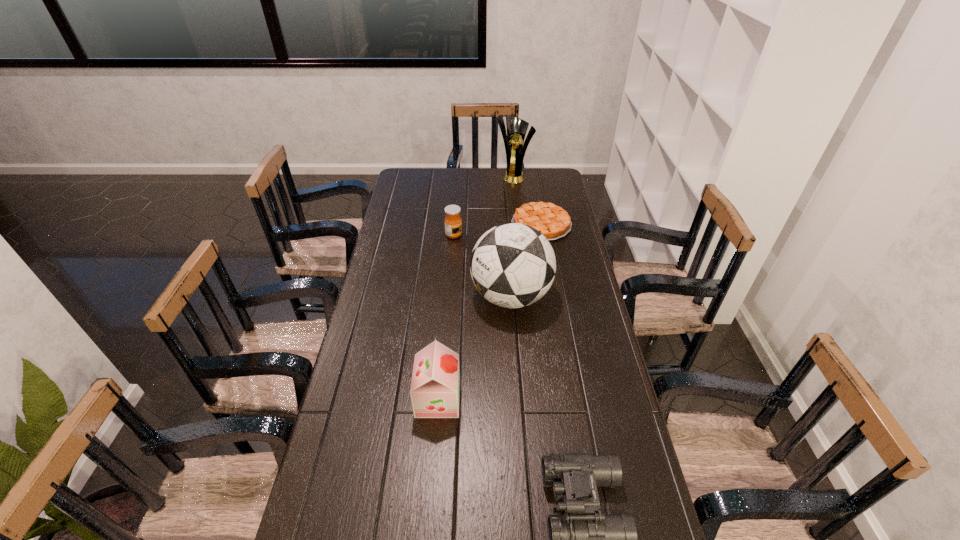
Find the location of a particular element. This screenshot has width=960, height=540. free location located 0.130m with the cap open on the fifth farthest object is located at coordinates (504, 399).

Where is `vacant space situated 0.180m on the front-facing side of the honey`? The image size is (960, 540). vacant space situated 0.180m on the front-facing side of the honey is located at coordinates (504, 235).

Where is `vacant space located on the back of the shortest object`? This screenshot has height=540, width=960. vacant space located on the back of the shortest object is located at coordinates (532, 171).

You are a GUI agent. You are given a task and a screenshot of the screen. Output one action in this format:
    pyautogui.click(x=<x>, y=<y>)
    Task: Click on the object located in the far edge section of the desktop
    The height and width of the screenshot is (540, 960).
    Given the screenshot: What is the action you would take?
    pyautogui.click(x=513, y=140)

Identify the location of award that is at the right edge. (513, 140).

The width and height of the screenshot is (960, 540). In order to click on soccer ball at the right edge in this screenshot , I will do `click(512, 265)`.

Find the location of a particular element. The height and width of the screenshot is (540, 960). pie positioned at the right edge is located at coordinates (553, 222).

This screenshot has width=960, height=540. What are the coordinates of `object situated at the far right corner` in the screenshot? It's located at (513, 140).

You are a GUI agent. You are given a task and a screenshot of the screen. Output one action in this format:
    pyautogui.click(x=<x>, y=<y>)
    Task: Click on the vacant space at the far edge of the desktop
    The width and height of the screenshot is (960, 540).
    Given the screenshot: What is the action you would take?
    pyautogui.click(x=494, y=181)

Identify the location of free space at the left edge of the desktop. Image resolution: width=960 pixels, height=540 pixels. (336, 439).